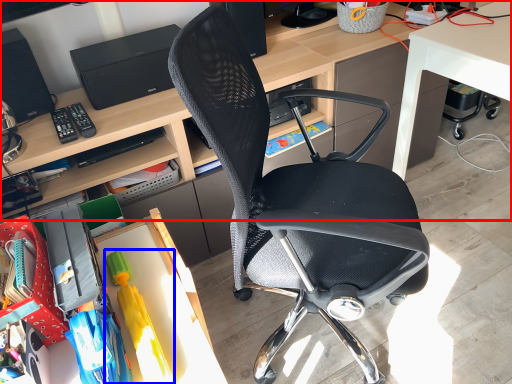
Question: Which point is closer to the camera, desk (highlighted by a red box) or toy (highlighted by a blue box)?

Choices:
 (A) desk
 (B) toy

Answer: (B)